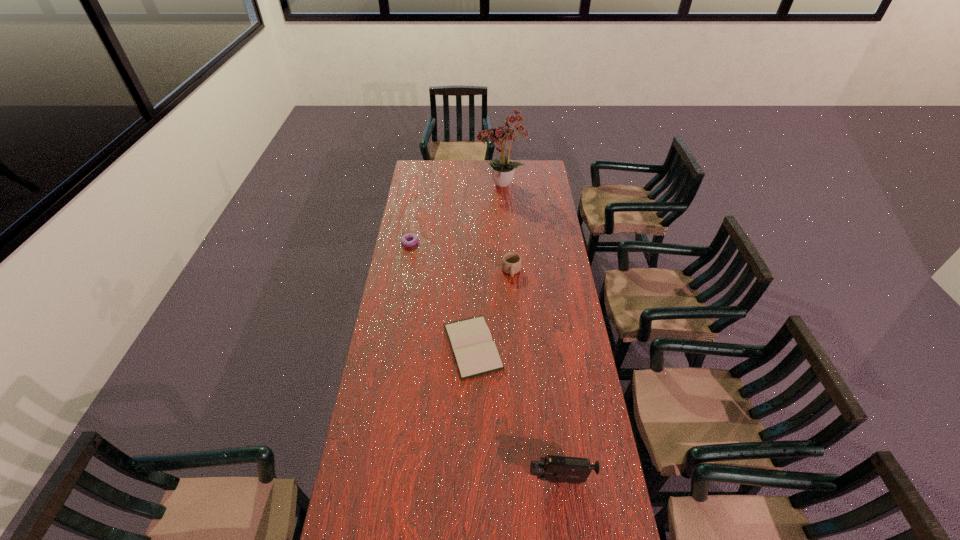
I want to click on vacant space that is in between the mug and the shortest object, so click(x=492, y=308).

Where is `free space between the farthest object and the camcorder`? The image size is (960, 540). free space between the farthest object and the camcorder is located at coordinates (531, 332).

Where is `vacant region between the mug and the shortest object`? The image size is (960, 540). vacant region between the mug and the shortest object is located at coordinates [492, 308].

In order to click on vacant area that lies between the hardback book and the nearest object in this screenshot , I will do `click(516, 413)`.

You are a GUI agent. You are given a task and a screenshot of the screen. Output one action in this format:
    pyautogui.click(x=<x>, y=<y>)
    Task: Click on the vacant area that lies between the farthest object and the hardback book
    
    Given the screenshot: What is the action you would take?
    pyautogui.click(x=487, y=266)

Locate an element on the screen. free space between the fourth tallest object and the second nearest object is located at coordinates click(x=442, y=294).

Identify the location of unoccupied area between the second shortest object and the farthest object. This screenshot has width=960, height=540. (455, 214).

I want to click on free space between the second farthest object and the tallest object, so click(455, 214).

The height and width of the screenshot is (540, 960). I want to click on object that is the second closest to the doughnut, so click(503, 170).

Identify the location of object that stands as the second closest to the hardback book. The height and width of the screenshot is (540, 960). (554, 469).